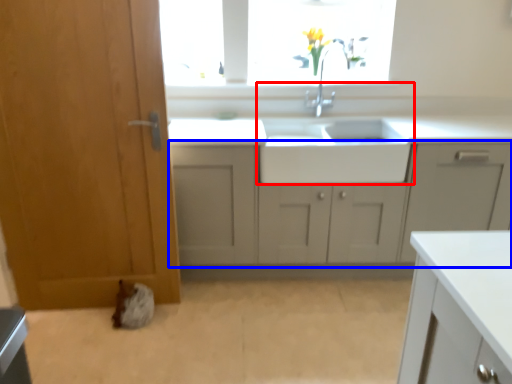
Question: Which of the following is the farthest to the observer, sink (highlighted by a red box) or cabinetry (highlighted by a blue box)?

Choices:
 (A) sink
 (B) cabinetry

Answer: (A)